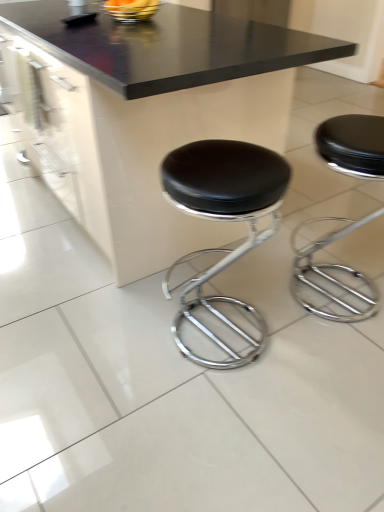
At what (x,y) coordinates should I click in order to perform the action: click on black leather stool at center, acting as the first stool starting from the right. Please return your answer as a coordinate pair (x, y). This screenshot has height=512, width=384. Looking at the image, I should click on (333, 276).

Locate an element on the screen. This screenshot has height=512, width=384. black glossy table at center is located at coordinates (153, 114).

Where is `black leather stool at center, the first stool in the left-to-right sequence`? This screenshot has height=512, width=384. black leather stool at center, the first stool in the left-to-right sequence is located at coordinates (223, 220).

Which object is closer to the camera, black leather stool at center, the second stool positioned from the right, or black glossy table at center?

black leather stool at center, the second stool positioned from the right.

Where is `table above the black leather stool at center, the second stool positioned from the right (from the image's perspective)`? This screenshot has width=384, height=512. table above the black leather stool at center, the second stool positioned from the right (from the image's perspective) is located at coordinates (153, 114).

Which is further, [268,195] or [213,28]?

Positioned behind is point [213,28].

Is black leather stool at center, the second stool positioned from the right, next to black glossy table at center and touching it?

They are not placed beside each other.

From a real-world perspective, which is physically above, metallic silver bowl at upper center or black leather stool at center, the second stool positioned from the right?

metallic silver bowl at upper center.

How far apart are metallic silver bowl at upper center and black leather stool at center, the first stool in the left-to-right sequence?

The distance of metallic silver bowl at upper center from black leather stool at center, the first stool in the left-to-right sequence, is 3.80 feet.

Who is taller, metallic silver bowl at upper center or black leather stool at center, the first stool in the left-to-right sequence?

black leather stool at center, the first stool in the left-to-right sequence, is taller.

Where is `food that is above the black leather stool at center, the second stool positioned from the right (from a real-world perspective)`? The image size is (384, 512). food that is above the black leather stool at center, the second stool positioned from the right (from a real-world perspective) is located at coordinates (131, 9).

From a real-world perspective, is black leather stool at center, the first stool in the left-to-right sequence, physically below metallic silver bowl at upper center?

Correct, in the physical world, black leather stool at center, the first stool in the left-to-right sequence, is lower than metallic silver bowl at upper center.

Considering the relative sizes of black leather stool at center, the first stool in the left-to-right sequence, and metallic silver bowl at upper center in the image provided, is black leather stool at center, the first stool in the left-to-right sequence, shorter than metallic silver bowl at upper center?

In fact, black leather stool at center, the first stool in the left-to-right sequence, may be taller than metallic silver bowl at upper center.

Is black leather stool at center, the first stool in the left-to-right sequence, oriented away from metallic silver bowl at upper center?

No, black leather stool at center, the first stool in the left-to-right sequence, is not facing away from metallic silver bowl at upper center.

Between black leather stool at center, acting as the 2th stool starting from the left, and black glossy table at center, which one has less height?

Standing shorter between the two is black leather stool at center, acting as the 2th stool starting from the left.

Is black glossy table at center completely or partially inside black leather stool at center, acting as the first stool starting from the right?

Actually, black glossy table at center is outside black leather stool at center, acting as the first stool starting from the right.

Consider the image. Could you measure the distance between black leather stool at center, acting as the 2th stool starting from the left, and black glossy table at center?

87.71 centimeters.

How many degrees apart are the facing directions of black leather stool at center, acting as the 2th stool starting from the left, and black glossy table at center?

black leather stool at center, acting as the 2th stool starting from the left, and black glossy table at center are facing 178 degrees away from each other.

From the image's perspective, would you say metallic silver bowl at upper center is positioned over black leather stool at center, acting as the first stool starting from the right?

Correct, metallic silver bowl at upper center appears higher than black leather stool at center, acting as the first stool starting from the right, in the image.

From a real-world perspective, which is physically above, metallic silver bowl at upper center or black leather stool at center, acting as the first stool starting from the right?

In real-world perspective, metallic silver bowl at upper center is above.

Is metallic silver bowl at upper center positioned with its back to black leather stool at center, acting as the 2th stool starting from the left?

No, metallic silver bowl at upper center is not facing away from black leather stool at center, acting as the 2th stool starting from the left.

Is point (372, 141) positioned before point (212, 170)?

No, it is not.

Between black leather stool at center, acting as the first stool starting from the right, and black leather stool at center, the first stool in the left-to-right sequence, which one is positioned in front?

black leather stool at center, the first stool in the left-to-right sequence, is closer to the camera.

From the image's perspective, who appears lower, black leather stool at center, acting as the 2th stool starting from the left, or black leather stool at center, the second stool positioned from the right?

black leather stool at center, the second stool positioned from the right, is shown below in the image.

Is black leather stool at center, acting as the first stool starting from the right, directly adjacent to black leather stool at center, the second stool positioned from the right?

There is a gap between black leather stool at center, acting as the first stool starting from the right, and black leather stool at center, the second stool positioned from the right.

Is black glossy table at center outside of black leather stool at center, the first stool in the left-to-right sequence?

That's correct, black glossy table at center is outside of black leather stool at center, the first stool in the left-to-right sequence.

Considering the relative sizes of black glossy table at center and black leather stool at center, the second stool positioned from the right, in the image provided, is black glossy table at center bigger than black leather stool at center, the second stool positioned from the right,?

Yes.

From a real-world perspective, is black glossy table at center under black leather stool at center, the second stool positioned from the right?

No, from a real-world perspective, black glossy table at center is not under black leather stool at center, the second stool positioned from the right.

What are the coordinates of `table above the black leather stool at center, the second stool positioned from the right (from the image's perspective)` in the screenshot? It's located at (153, 114).

Where is `the 1st stool to the right when counting from the metallic silver bowl at upper center`? the 1st stool to the right when counting from the metallic silver bowl at upper center is located at coordinates (223, 220).

Consider the image. Which object lies nearer to the anchor point black leather stool at center, acting as the 2th stool starting from the left, black leather stool at center, the first stool in the left-to-right sequence, or metallic silver bowl at upper center?

Among the two, black leather stool at center, the first stool in the left-to-right sequence, is located nearer to black leather stool at center, acting as the 2th stool starting from the left.

Based on their spatial positions, is metallic silver bowl at upper center or black leather stool at center, acting as the 2th stool starting from the left, further from black glossy table at center?

black leather stool at center, acting as the 2th stool starting from the left, is positioned further to the anchor black glossy table at center.

Estimate the real-world distances between objects in this image. Which object is closer to metallic silver bowl at upper center, black leather stool at center, the first stool in the left-to-right sequence, or black leather stool at center, acting as the first stool starting from the right?

black leather stool at center, the first stool in the left-to-right sequence, is positioned closer to the anchor metallic silver bowl at upper center.

Considering their positions, is black leather stool at center, acting as the 2th stool starting from the left, positioned further to black leather stool at center, the second stool positioned from the right, than black glossy table at center?

black glossy table at center is positioned further to the anchor black leather stool at center, the second stool positioned from the right.

Considering their positions, is metallic silver bowl at upper center positioned further to black leather stool at center, acting as the 2th stool starting from the left, than black glossy table at center?

metallic silver bowl at upper center lies further to black leather stool at center, acting as the 2th stool starting from the left, than the other object.

Considering their positions, is black glossy table at center positioned closer to metallic silver bowl at upper center than black leather stool at center, acting as the 2th stool starting from the left?

The object closer to metallic silver bowl at upper center is black glossy table at center.

From the picture: Estimate the real-world distances between objects in this image. Which object is further from black leather stool at center, the second stool positioned from the right, metallic silver bowl at upper center or black glossy table at center?

The object further to black leather stool at center, the second stool positioned from the right, is metallic silver bowl at upper center.

From the image, which object appears to be farther from black leather stool at center, the first stool in the left-to-right sequence, black glossy table at center or metallic silver bowl at upper center?

metallic silver bowl at upper center lies further to black leather stool at center, the first stool in the left-to-right sequence, than the other object.

In order to click on stool between metallic silver bowl at upper center and black leather stool at center, the second stool positioned from the right, from top to bottom in this screenshot , I will do `click(333, 276)`.

You are a GUI agent. You are given a task and a screenshot of the screen. Output one action in this format:
    pyautogui.click(x=<x>, y=<y>)
    Task: Click on the table between metallic silver bowl at upper center and black leather stool at center, the second stool positioned from the right, in the up-down direction
    The height and width of the screenshot is (512, 384).
    Given the screenshot: What is the action you would take?
    pyautogui.click(x=153, y=114)

I want to click on food located between black glossy table at center and black leather stool at center, acting as the 2th stool starting from the left, in the left-right direction, so click(x=131, y=9).

Where is `stool between black glossy table at center and black leather stool at center, acting as the first stool starting from the right, from left to right`? This screenshot has width=384, height=512. stool between black glossy table at center and black leather stool at center, acting as the first stool starting from the right, from left to right is located at coordinates (223, 220).